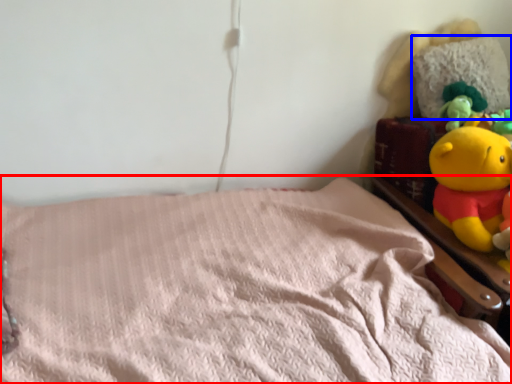
Question: Among these objects, which one is nearest to the camera, bed (highlighted by a red box) or pillow (highlighted by a blue box)?

Choices:
 (A) bed
 (B) pillow

Answer: (A)